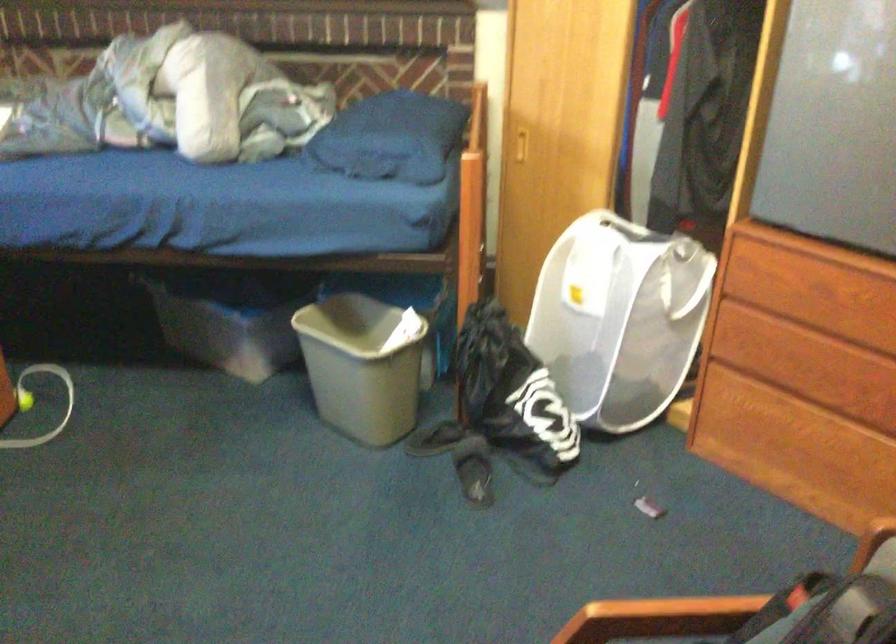
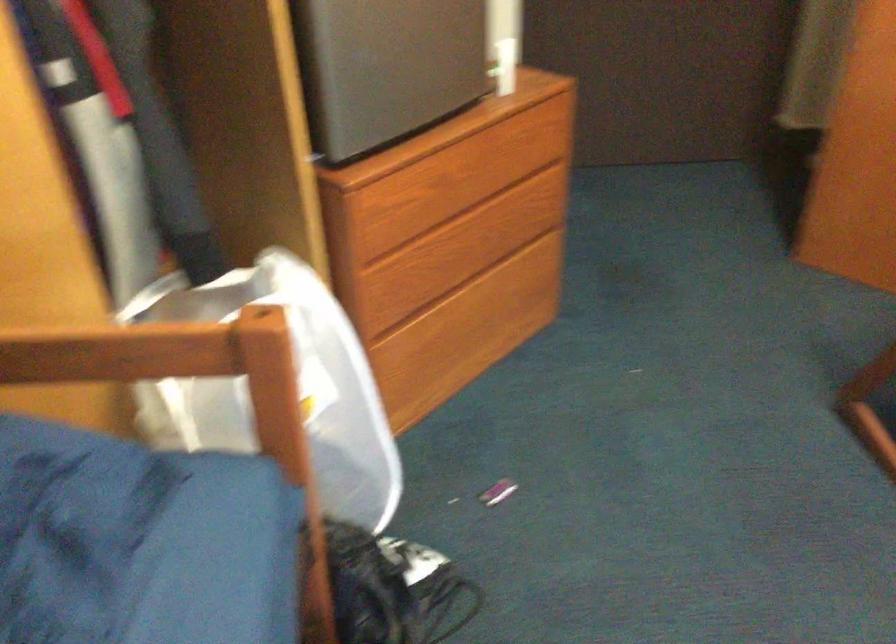
Question: I am providing you with two images of the same scene from different viewpoints. Which of the following objects are not visible in image2?

Choices:
 (A) dresser drawer lip
 (B) small purple object
 (C) white hamper handle
 (D) chair adjustment lever

Answer: (C)